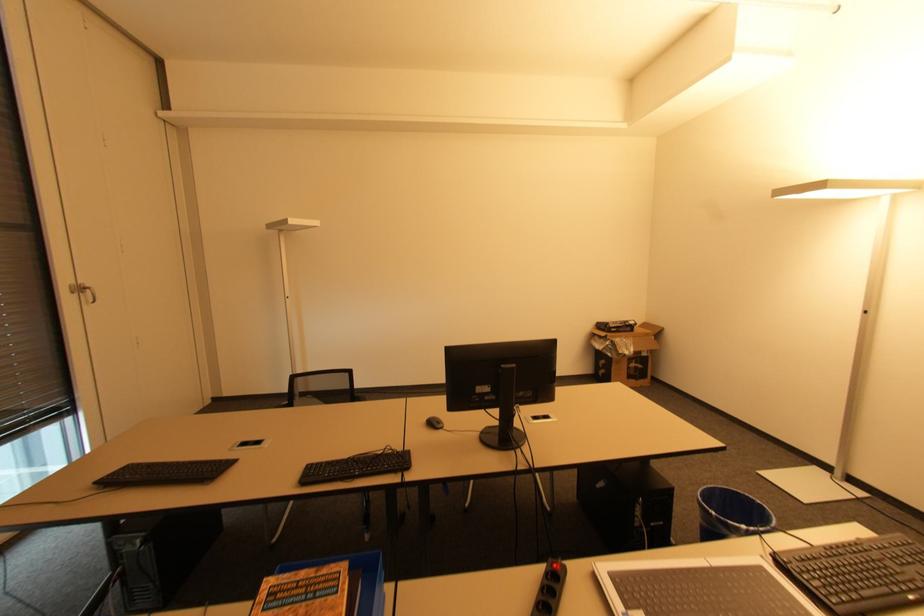
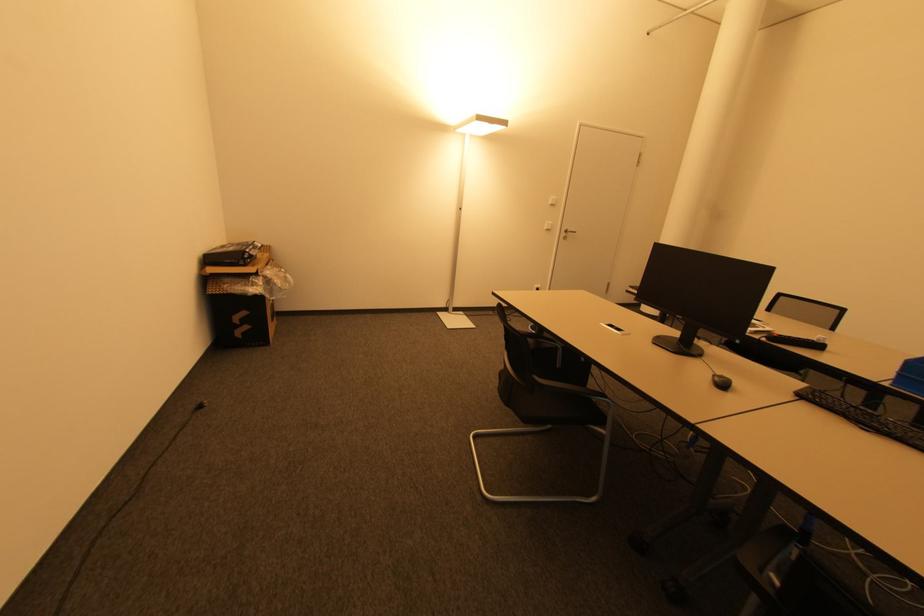
In the second image, find the point that corresponds to [615,330] in the first image.

(250, 261)